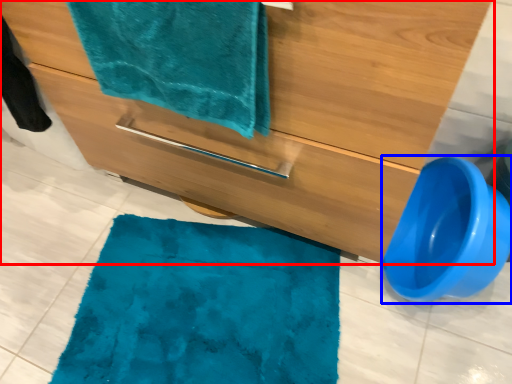
Question: Which point is closer to the camera, bathroom cabinet (highlighted by a red box) or toilet bowl (highlighted by a blue box)?

Choices:
 (A) bathroom cabinet
 (B) toilet bowl

Answer: (A)